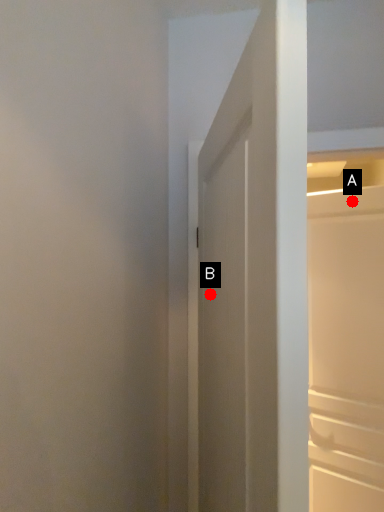
Question: Two points are circled on the image, labeled by A and B beside each circle. Which point appears farthest from the camera in this image?

Choices:
 (A) A is further
 (B) B is further

Answer: (A)